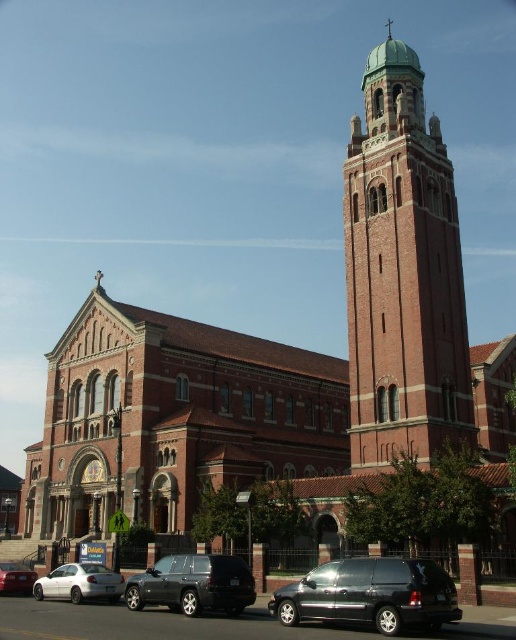
You are a visitor arriving at the church and want to park your car. You see a shiny black suv at lower left and a matte white sedan at lower left. Which car is parked closer to the entrance of the church?

The shiny black suv at lower left is located above the matte white sedan at lower left, so the shiny black suv at lower left is closer to the entrance of the church.

You are a delivery driver who needs to park your truck next to the shiny black suv at lower left and the matte white sedan at lower left. Considering their sizes, which vehicle should you park closer to so that your truck doesn,t block the entrance of the church?

The shiny black suv at lower left is larger than the matte white sedan at lower left. To avoid blocking the entrance, park closer to the shiny black suv at lower left since it takes up more space and is less likely to obstruct the path.